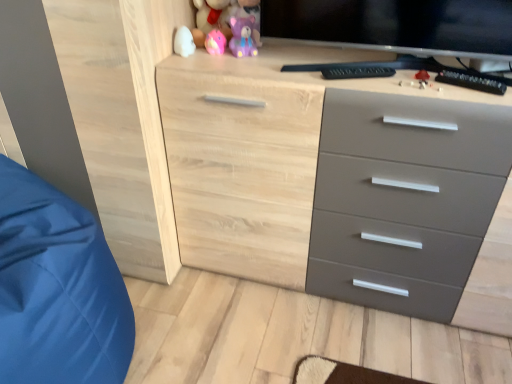
Locate an element on the screen. The width and height of the screenshot is (512, 384). vacant area situated to the left side of purple matte bear at upper center, the 3th toy from the top is located at coordinates (195, 56).